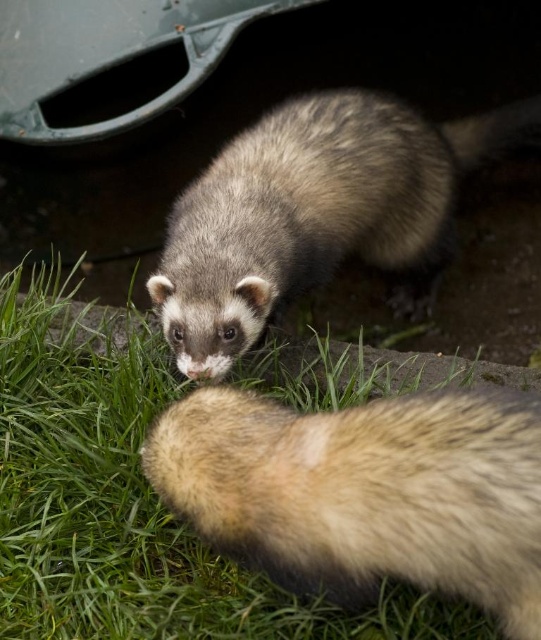
Question: Is green grass at lower left thinner than fuzzy fur at lower center?

Choices:
 (A) yes
 (B) no

Answer: (B)

Question: Does green grass at lower left have a smaller size compared to fuzzy fur at lower center?

Choices:
 (A) no
 (B) yes

Answer: (A)

Question: Which is farther from the green grass at lower left?

Choices:
 (A) fuzzy fur at lower center
 (B) fuzzy brown ferret at center

Answer: (B)

Question: Based on their relative distances, which object is farther from the green grass at lower left?

Choices:
 (A) fuzzy fur at lower center
 (B) fuzzy brown ferret at center

Answer: (B)

Question: Which point is closer to the camera?

Choices:
 (A) (192, 400)
 (B) (115, 492)
 (C) (397, 113)

Answer: (A)

Question: Observing the image, what is the correct spatial positioning of green grass at lower left in reference to fuzzy fur at lower center?

Choices:
 (A) below
 (B) above

Answer: (B)